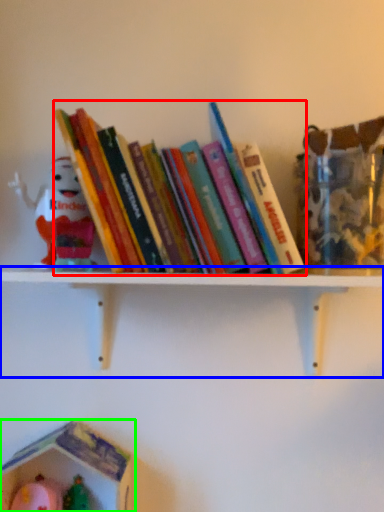
Question: Estimate the real-world distances between objects in this image. Which object is closer to book (highlighted by a red box), shelf (highlighted by a blue box) or toy (highlighted by a green box)?

Choices:
 (A) shelf
 (B) toy

Answer: (A)